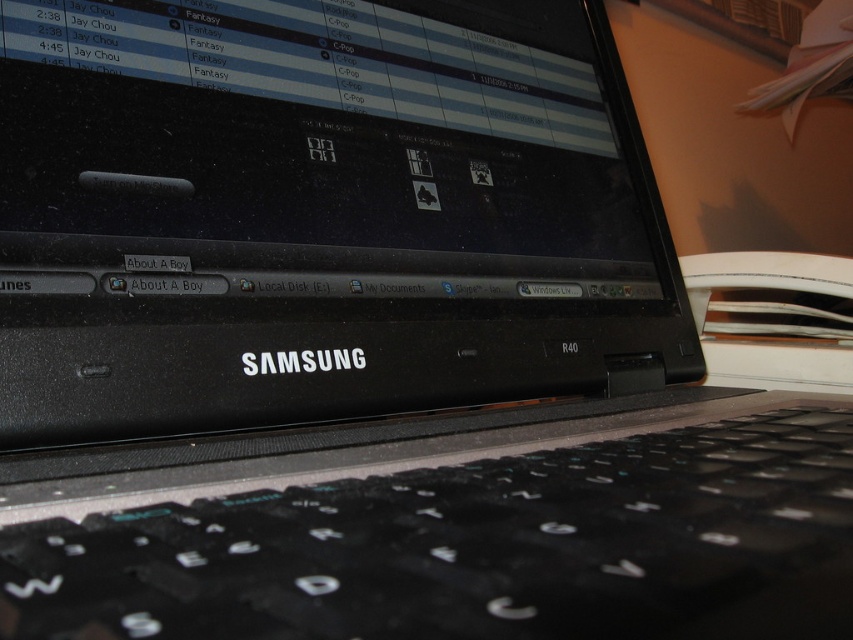
What are the coordinates of `black matte computer screen at center` in the screenshot? It's located at (312, 150).

Does black matte computer screen at center come behind black plastic keyboard at center?

Yes, black matte computer screen at center is behind black plastic keyboard at center.

The image size is (853, 640). I want to click on black matte computer screen at center, so click(x=312, y=150).